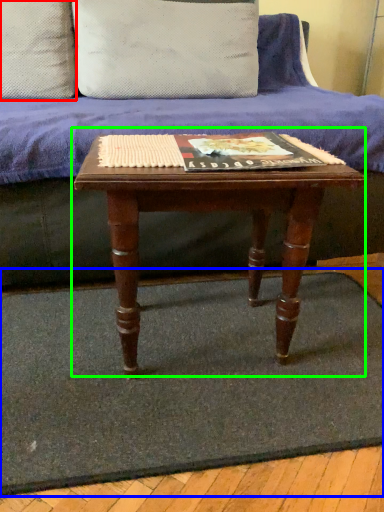
Question: Which object is the farthest from pillow (highlighted by a red box)? Choose among these: doormat (highlighted by a blue box) or table (highlighted by a green box).

Choices:
 (A) doormat
 (B) table

Answer: (A)